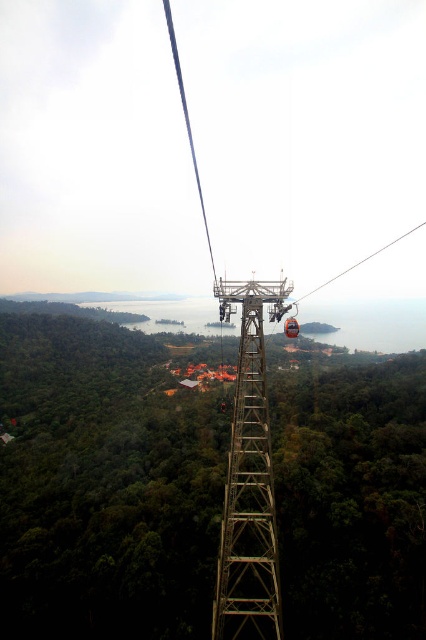
Who is positioned more to the right, metallic structure at center or metallic cable car at center?

metallic cable car at center

Can you confirm if metallic structure at center is positioned above metallic cable car at center?

Incorrect, metallic structure at center is not positioned above metallic cable car at center.

This screenshot has width=426, height=640. Find the location of `metallic structure at center`. metallic structure at center is located at coordinates (249, 477).

Can you confirm if metallic structure at center is thinner than blue wire at center?

Yes.

Between point (222, 600) and point (173, 45), which one is positioned behind?

Point (173, 45)

Identify the location of metallic structure at center. (x=249, y=477).

Who is positioned more to the right, blue wire at center or metallic cable car at center?

metallic cable car at center

Which is below, blue wire at center or metallic cable car at center?

Positioned lower is metallic cable car at center.

Does point (187, 115) come closer to viewer compared to point (368, 253)?

No, (187, 115) is behind (368, 253).

The height and width of the screenshot is (640, 426). In order to click on blue wire at center in this screenshot , I will do `click(187, 122)`.